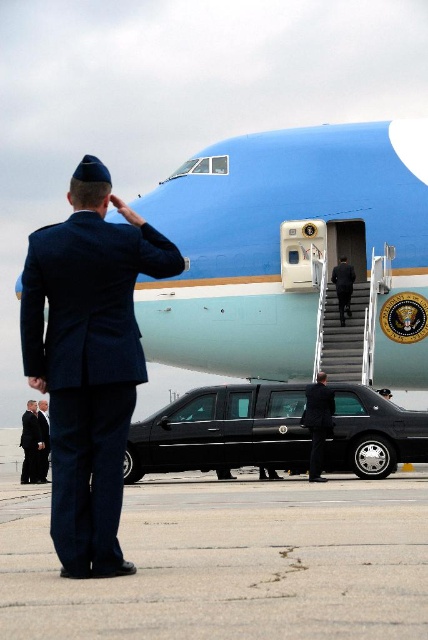
Can you confirm if gray/stainless steel stairs at center is taller than black suit at center?

Incorrect, gray/stainless steel stairs at center's height is not larger of black suit at center's.

Does point (323, 326) come farther from viewer compared to point (347, 276)?

No, (323, 326) is in front of (347, 276).

Locate an element on the screen. This screenshot has width=428, height=640. gray/stainless steel stairs at center is located at coordinates (342, 333).

Can you confirm if gray/stainless steel stairs at center is positioned to the right of dark blue suit at center?

Correct, you'll find gray/stainless steel stairs at center to the right of dark blue suit at center.

Looking at this image, who is higher up, gray/stainless steel stairs at center or dark blue suit at center?

gray/stainless steel stairs at center is above.

Where is `gray/stainless steel stairs at center`? gray/stainless steel stairs at center is located at coordinates (342, 333).

In order to click on gray/stainless steel stairs at center in this screenshot , I will do `click(342, 333)`.

Can you confirm if blue metallic airplane at center is bigger than black suit at center?

Indeed, blue metallic airplane at center has a larger size compared to black suit at center.

Is blue metallic airplane at center above black suit at center?

Yes, blue metallic airplane at center is above black suit at center.

Is point (166, 220) positioned before point (344, 314)?

No, it is not.

Locate an element on the screen. blue metallic airplane at center is located at coordinates (293, 252).